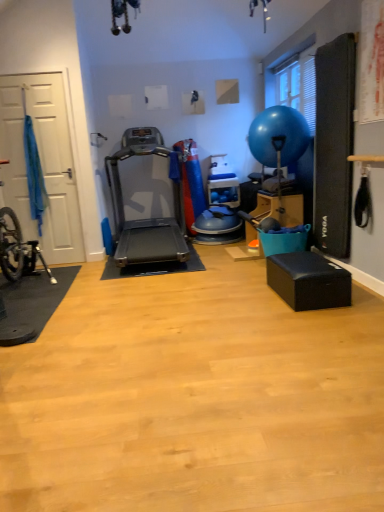
Question: Is white matte door at left inside silver metallic treadmill at center?

Choices:
 (A) no
 (B) yes

Answer: (A)

Question: Is silver metallic treadmill at center closer to camera compared to white matte door at left?

Choices:
 (A) no
 (B) yes

Answer: (B)

Question: Does silver metallic treadmill at center have a smaller size compared to white matte door at left?

Choices:
 (A) no
 (B) yes

Answer: (A)

Question: From the image's perspective, is silver metallic treadmill at center over white matte door at left?

Choices:
 (A) yes
 (B) no

Answer: (B)

Question: Is white matte door at left at the back of silver metallic treadmill at center?

Choices:
 (A) yes
 (B) no

Answer: (B)

Question: From the image's perspective, relative to blue rubber balloon at upper right, is silver metallic treadmill at center above or below?

Choices:
 (A) below
 (B) above

Answer: (A)

Question: From a real-world perspective, is silver metallic treadmill at center above or below blue rubber balloon at upper right?

Choices:
 (A) below
 (B) above

Answer: (A)

Question: Looking at the image, does silver metallic treadmill at center seem bigger or smaller compared to blue rubber balloon at upper right?

Choices:
 (A) small
 (B) big

Answer: (B)

Question: Which is correct: silver metallic treadmill at center is inside blue rubber balloon at upper right, or outside of it?

Choices:
 (A) outside
 (B) inside

Answer: (A)

Question: Considering the positions of white matte door at left and silver metallic treadmill at center in the image, is white matte door at left bigger or smaller than silver metallic treadmill at center?

Choices:
 (A) big
 (B) small

Answer: (B)

Question: In terms of height, does white matte door at left look taller or shorter compared to silver metallic treadmill at center?

Choices:
 (A) short
 (B) tall

Answer: (B)

Question: Visually, is white matte door at left positioned to the left or to the right of silver metallic treadmill at center?

Choices:
 (A) right
 (B) left

Answer: (B)

Question: Relative to silver metallic treadmill at center, is white matte door at left in front or behind?

Choices:
 (A) front
 (B) behind

Answer: (B)

Question: In terms of size, does silver metallic treadmill at center appear bigger or smaller than white matte door at left?

Choices:
 (A) small
 (B) big

Answer: (B)

Question: Is silver metallic treadmill at center taller or shorter than white matte door at left?

Choices:
 (A) tall
 (B) short

Answer: (B)